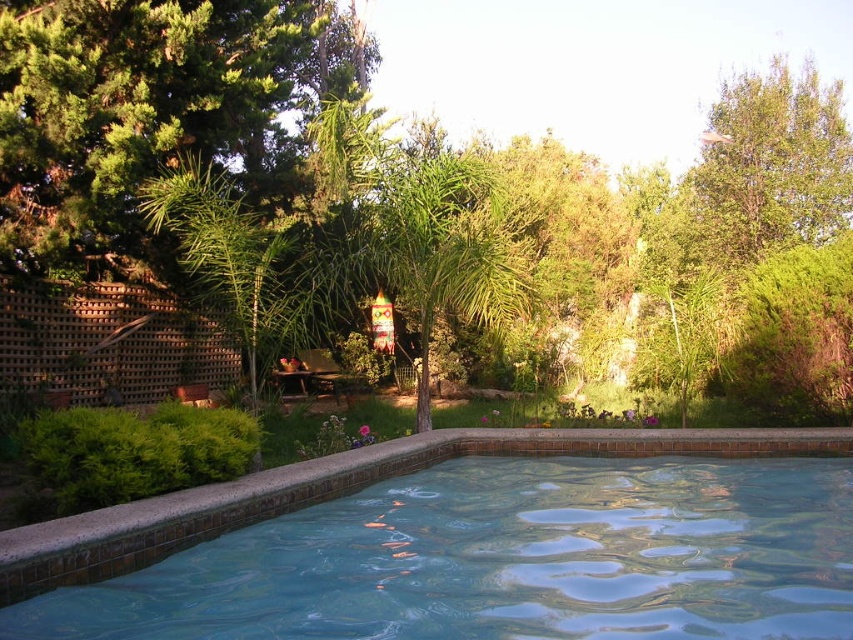
Question: Which of these objects is positioned closest to the green leafy palm tree at center?

Choices:
 (A) smooth concrete pool at center
 (B) green leafy tree at upper center

Answer: (A)

Question: Where is smooth concrete pool at center located in relation to green leafy palm tree at center in the image?

Choices:
 (A) above
 (B) below

Answer: (B)

Question: Which point appears closest to the camera in this image?

Choices:
 (A) (33, 145)
 (B) (131, 602)

Answer: (B)

Question: Does green leafy tree at upper center have a lesser width compared to green leafy palm tree at center?

Choices:
 (A) yes
 (B) no

Answer: (B)

Question: Is smooth concrete pool at center further to the viewer compared to green leafy palm tree at center?

Choices:
 (A) yes
 (B) no

Answer: (B)

Question: Which of these objects is positioned farthest from the green leafy palm tree at center?

Choices:
 (A) green leafy tree at upper center
 (B) smooth concrete pool at center

Answer: (A)